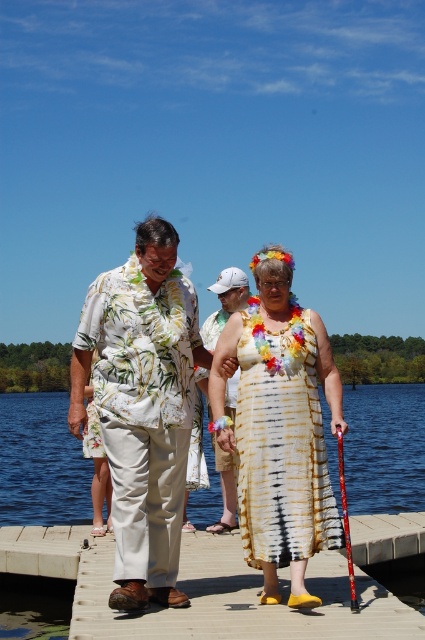
You are a photographer standing at the dock and want to take a photo of the floral fabric shirt at center and the white floral shirt at center. Which shirt should you focus on first to ensure it appears sharp in the photo?

You should focus on the floral fabric shirt at center first because it is closer to the viewer than the white floral shirt at center, so focusing on the closer one ensures sharpness.

You are a photographer trying to capture the scene from above. Which object, the wooden at center or the white floral shirt at center, would appear lower in the photo?

The wooden at center is below the white floral shirt at center, so in the photo taken from above, the wooden at center would appear lower.